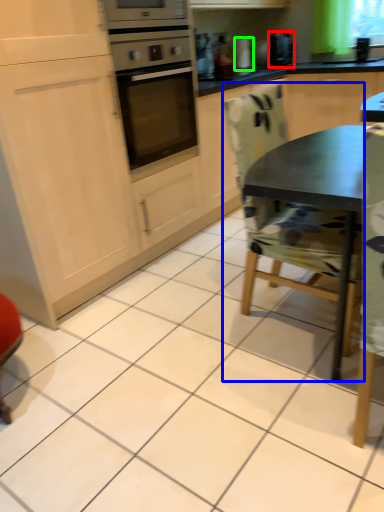
Question: Based on their relative distances, which object is nearer to coffee machine (highlighted by a red box)? Choose from chair (highlighted by a blue box) and appliance (highlighted by a green box).

Choices:
 (A) chair
 (B) appliance

Answer: (B)